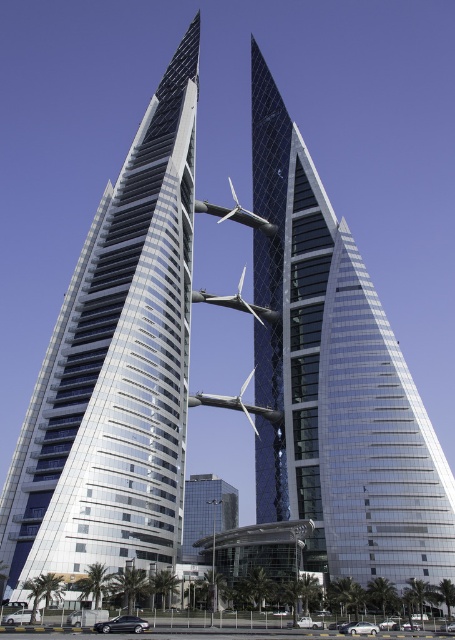
Can you confirm if shiny glass skyscraper at center is smaller than glassy silver skyscraper at center?

Yes, shiny glass skyscraper at center is smaller than glassy silver skyscraper at center.

Between point (153, 188) and point (345, 243), which one is positioned behind?

The point (345, 243) is behind.

What are the coordinates of `shiny glass skyscraper at center` in the screenshot? It's located at (116, 369).